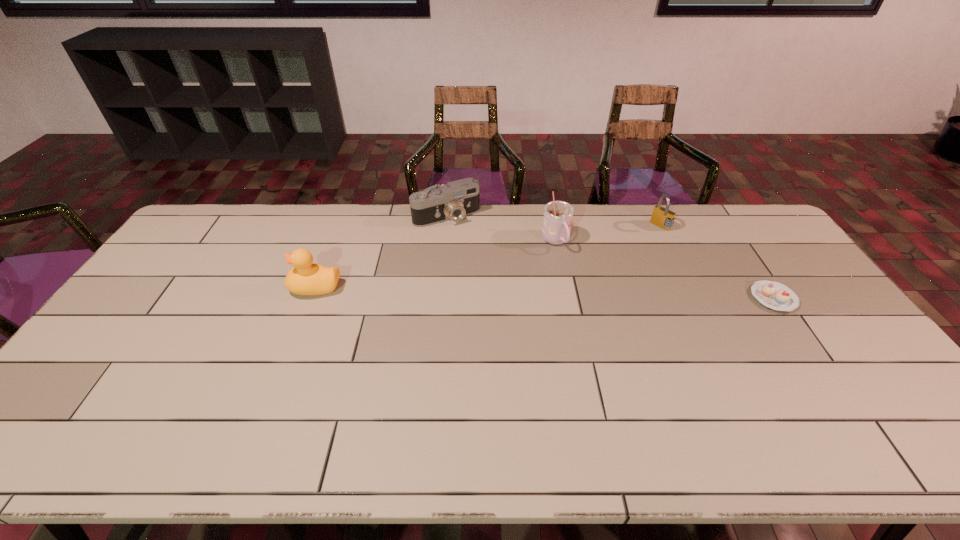
At what (x,y) coordinates should I click in order to perform the action: click on free space located 0.100m on the side with the combination dials of the padlock. Please return your answer as a coordinate pair (x, y). The height and width of the screenshot is (540, 960). Looking at the image, I should click on (641, 242).

This screenshot has width=960, height=540. I want to click on vacant space located 0.180m on the side with the combination dials of the padlock, so click(x=628, y=253).

In order to click on vacant space located on the side with the combination dials of the padlock in this screenshot , I will do `click(590, 282)`.

At what (x,y) coordinates should I click in order to perform the action: click on vacant space situated on the side with the handle of the third object from right to left. Please return your answer as a coordinate pair (x, y). The height and width of the screenshot is (540, 960). Looking at the image, I should click on (610, 321).

Where is `vacant area located on the side with the handle of the third object from right to left`? vacant area located on the side with the handle of the third object from right to left is located at coordinates (572, 267).

Where is `vacant space located 0.390m on the side with the handle of the third object from right to left`? vacant space located 0.390m on the side with the handle of the third object from right to left is located at coordinates (624, 342).

Where is `free space located on the lens of the second object from left to right`? free space located on the lens of the second object from left to right is located at coordinates (x=483, y=259).

Locate an element on the screen. This screenshot has width=960, height=540. vacant space located on the lens of the second object from left to right is located at coordinates (483, 259).

Image resolution: width=960 pixels, height=540 pixels. I want to click on vacant area located on the lens of the second object from left to right, so click(x=482, y=258).

Identify the location of padlock located in the far edge section of the desktop. The width and height of the screenshot is (960, 540). (662, 217).